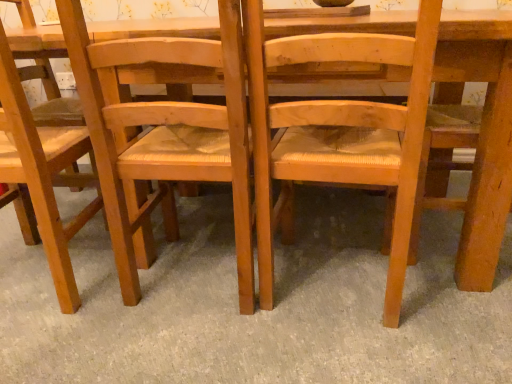
Identify the location of vacant area to the right of natural wood chair at center, the third chair viewed from the left. (451, 296).